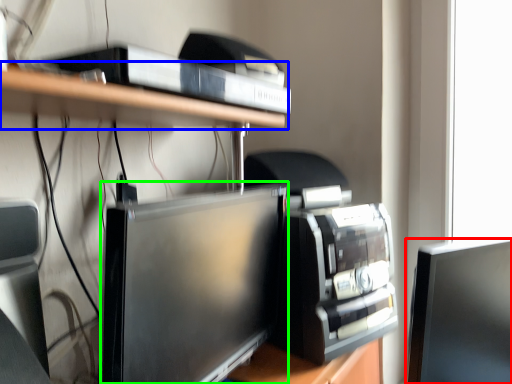
Question: Which object is positioned farthest from computer monitor (highlighted by a red box)? Select from shelf (highlighted by a blue box) and computer monitor (highlighted by a green box).

Choices:
 (A) shelf
 (B) computer monitor

Answer: (A)